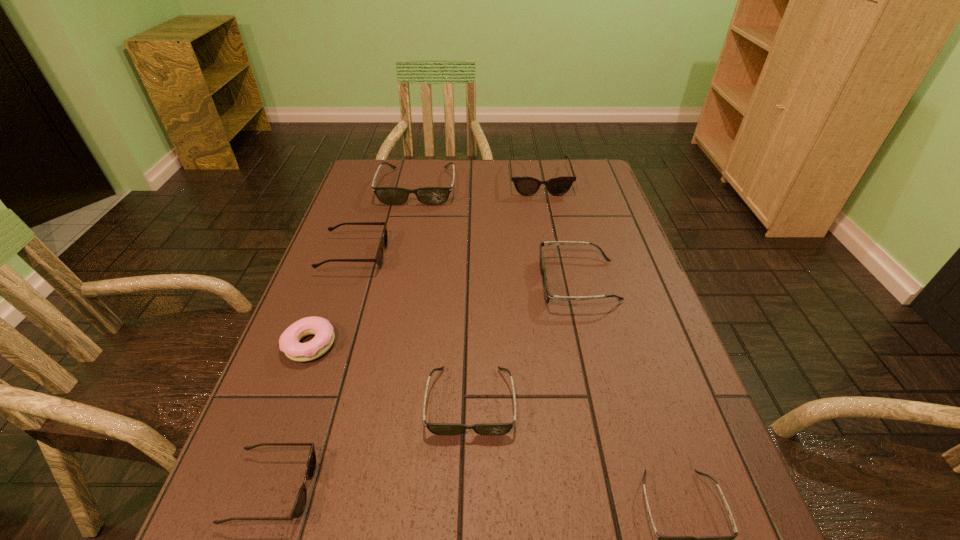
Where is `object present at the far left corner`? Image resolution: width=960 pixels, height=540 pixels. object present at the far left corner is located at coordinates [388, 195].

Where is `object present at the far right corner`? The width and height of the screenshot is (960, 540). object present at the far right corner is located at coordinates (526, 186).

The image size is (960, 540). In the image, there is a desktop. Identify the location of vacant space at the far edge. (463, 167).

At what (x,y) coordinates should I click in order to perform the action: click on free space at the left edge of the desktop. Please return your answer as a coordinate pair (x, y). Looking at the image, I should click on (372, 212).

At what (x,y) coordinates should I click in order to perform the action: click on vacant space at the right edge. Please return your answer as a coordinate pair (x, y). This screenshot has height=540, width=960. Looking at the image, I should click on (612, 253).

The image size is (960, 540). I want to click on blank space at the far left corner of the desktop, so click(363, 167).

You are a GUI agent. You are given a task and a screenshot of the screen. Output one action in this format:
    pyautogui.click(x=<x>, y=<y>)
    Task: Click on the free space between the third farthest black sunglasses and the second farthest black sunglasses
    This screenshot has height=540, width=960.
    Given the screenshot: What is the action you would take?
    pyautogui.click(x=524, y=341)

Where is `unoccupied area between the biggest black sunglasses and the second biggest brown sunglasses`? Image resolution: width=960 pixels, height=540 pixels. unoccupied area between the biggest black sunglasses and the second biggest brown sunglasses is located at coordinates (386, 221).

You are a GUI agent. You are given a task and a screenshot of the screen. Output one action in this format:
    pyautogui.click(x=<x>, y=<y>)
    Task: Click on the free space between the second nearest brown sunglasses and the biggest brown sunglasses
    
    Given the screenshot: What is the action you would take?
    pyautogui.click(x=446, y=218)

Image resolution: width=960 pixels, height=540 pixels. Find the location of `empty space between the nearest brown sunglasses and the rightmost brown sunglasses`. empty space between the nearest brown sunglasses and the rightmost brown sunglasses is located at coordinates (406, 334).